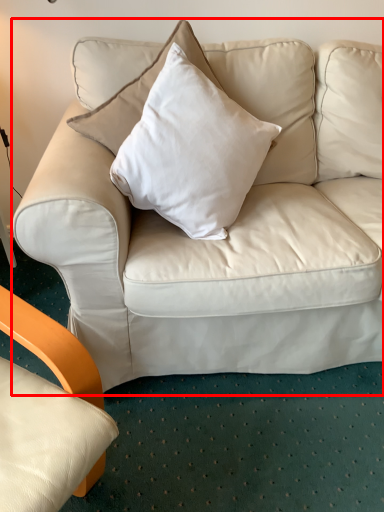
Question: In this image, where is studio couch (annotated by the red box) located relative to pillow?

Choices:
 (A) right
 (B) left

Answer: (B)